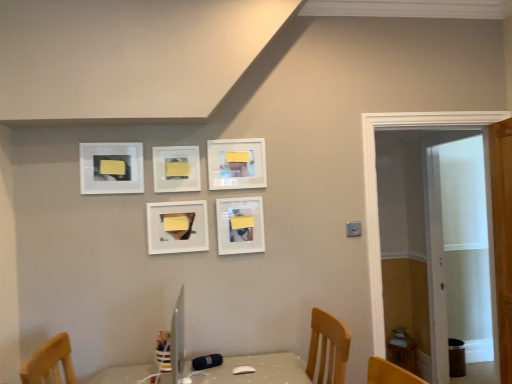
Where is `white wooden door at right`? This screenshot has height=384, width=512. white wooden door at right is located at coordinates (376, 185).

Describe the element at coordinates (236, 163) in the screenshot. I see `matte white picture frame at upper center, which is counted as the second picture frame, starting from the right` at that location.

Based on the photo, measure the distance between point [103,167] and camera.

Point [103,167] and camera are 7.50 feet apart from each other.

Describe the element at coordinates (177, 227) in the screenshot. I see `matte white picture frame at center, marked as the third picture frame in a right-to-left arrangement` at that location.

I want to click on matte white picture frame at center, placed as the 5th picture frame when sorted from left to right, so click(240, 225).

From the image's perspective, is matte white picture frame at center, which appears as the 1th picture frame when viewed from the right, located above yellow matte picture frame at center, the fourth picture frame in the right-to-left sequence?

No, from the image's perspective, matte white picture frame at center, which appears as the 1th picture frame when viewed from the right, is not on top of yellow matte picture frame at center, the fourth picture frame in the right-to-left sequence.

From a real-world perspective, is matte white picture frame at center, which appears as the 1th picture frame when viewed from the right, over yellow matte picture frame at center, the 2th picture frame positioned from the left?

Incorrect, from a real-world perspective, matte white picture frame at center, which appears as the 1th picture frame when viewed from the right, is lower than yellow matte picture frame at center, the 2th picture frame positioned from the left.

Is matte white picture frame at center, which appears as the 1th picture frame when viewed from the right, oriented towards yellow matte picture frame at center, the 2th picture frame positioned from the left?

No, matte white picture frame at center, which appears as the 1th picture frame when viewed from the right, is not turned towards yellow matte picture frame at center, the 2th picture frame positioned from the left.

Is matte white picture frame at center, placed as the 5th picture frame when sorted from left to right, inside or outside of yellow matte picture frame at center, the 2th picture frame positioned from the left?

matte white picture frame at center, placed as the 5th picture frame when sorted from left to right, is outside yellow matte picture frame at center, the 2th picture frame positioned from the left.

In the image, is matte white picture frame at center, which appears as the 1th picture frame when viewed from the right, positioned in front of or behind matte white picture frame at center, marked as the third picture frame in a right-to-left arrangement?

matte white picture frame at center, which appears as the 1th picture frame when viewed from the right, is positioned farther from the viewer than matte white picture frame at center, marked as the third picture frame in a right-to-left arrangement.

From the image's perspective, is matte white picture frame at center, placed as the 5th picture frame when sorted from left to right, on matte white picture frame at center, arranged as the 3th picture frame when viewed from the left?

Yes, from the image's perspective, matte white picture frame at center, placed as the 5th picture frame when sorted from left to right, is above matte white picture frame at center, arranged as the 3th picture frame when viewed from the left.

Between matte white picture frame at center, placed as the 5th picture frame when sorted from left to right, and matte white picture frame at center, marked as the third picture frame in a right-to-left arrangement, which one has more height?

Standing taller between the two is matte white picture frame at center, placed as the 5th picture frame when sorted from left to right.

Consider the image. Are matte white picture frame at center, placed as the 5th picture frame when sorted from left to right, and matte white picture frame at center, marked as the third picture frame in a right-to-left arrangement, beside each other?

There is a gap between matte white picture frame at center, placed as the 5th picture frame when sorted from left to right, and matte white picture frame at center, marked as the third picture frame in a right-to-left arrangement.

From a real-world perspective, is matte white picture frame at center, arranged as the 3th picture frame when viewed from the left, under white wooden door at right?

No.

In the scene shown: From the image's perspective, is matte white picture frame at center, arranged as the 3th picture frame when viewed from the left, below white wooden door at right?

No, from the image's perspective, matte white picture frame at center, arranged as the 3th picture frame when viewed from the left, is not beneath white wooden door at right.

What's the angular difference between matte white picture frame at center, arranged as the 3th picture frame when viewed from the left, and white wooden door at right's facing directions?

They differ by 1.03 degrees in their facing directions.

This screenshot has height=384, width=512. Find the location of `picture frame that is the 2nd object above the white wooden door at right (from a real-world perspective)`. picture frame that is the 2nd object above the white wooden door at right (from a real-world perspective) is located at coordinates (177, 227).

From a real-world perspective, between matte white picture frame at center, placed as the 5th picture frame when sorted from left to right, and matte white picture frame at upper left, the 1th picture frame positioned from the left, who is vertically lower?

From a 3D spatial view, matte white picture frame at center, placed as the 5th picture frame when sorted from left to right, is below.

Is matte white picture frame at center, which appears as the 1th picture frame when viewed from the right, facing away from matte white picture frame at upper left, arranged as the fifth picture frame when viewed from the right?

No.

Can you confirm if matte white picture frame at center, placed as the 5th picture frame when sorted from left to right, is positioned to the right of matte white picture frame at upper left, arranged as the fifth picture frame when viewed from the right?

Yes.

Who is smaller, matte white picture frame at center, placed as the 5th picture frame when sorted from left to right, or matte white picture frame at upper left, the 1th picture frame positioned from the left?

Smaller between the two is matte white picture frame at upper left, the 1th picture frame positioned from the left.

Is white wooden door at right not near yellow matte picture frame at center, the 2th picture frame positioned from the left?

Yes, white wooden door at right and yellow matte picture frame at center, the 2th picture frame positioned from the left, are quite far apart.

Is white wooden door at right situated inside yellow matte picture frame at center, the fourth picture frame in the right-to-left sequence, or outside?

white wooden door at right lies outside yellow matte picture frame at center, the fourth picture frame in the right-to-left sequence.

Is white wooden door at right aimed at yellow matte picture frame at center, the fourth picture frame in the right-to-left sequence?

No, white wooden door at right does not turn towards yellow matte picture frame at center, the fourth picture frame in the right-to-left sequence.

Which picture frame is the 3rd one when counting from the front of the white wooden door at right? Please provide its 2D coordinates.

[(176, 169)]

From the image's perspective, is matte white picture frame at upper left, the 1th picture frame positioned from the left, below yellow matte picture frame at center, the 2th picture frame positioned from the left?

Actually, matte white picture frame at upper left, the 1th picture frame positioned from the left, appears above yellow matte picture frame at center, the 2th picture frame positioned from the left, in the image.

Is matte white picture frame at upper left, arranged as the fifth picture frame when viewed from the right, inside the boundaries of yellow matte picture frame at center, the 2th picture frame positioned from the left, or outside?

matte white picture frame at upper left, arranged as the fifth picture frame when viewed from the right, is not inside yellow matte picture frame at center, the 2th picture frame positioned from the left, it's outside.

Is the position of matte white picture frame at upper left, the 1th picture frame positioned from the left, more distant than that of yellow matte picture frame at center, the fourth picture frame in the right-to-left sequence?

No, the depth of matte white picture frame at upper left, the 1th picture frame positioned from the left, is less than that of yellow matte picture frame at center, the fourth picture frame in the right-to-left sequence.

Locate an element on the screen. the 1st picture frame to the right of the matte white picture frame at upper left, arranged as the fifth picture frame when viewed from the right, counting from the anchor's position is located at coordinates (176, 169).

Is matte white picture frame at upper left, arranged as the fifth picture frame when viewed from the right, behind matte white picture frame at center, which appears as the 1th picture frame when viewed from the right?

No, matte white picture frame at upper left, arranged as the fifth picture frame when viewed from the right, is closer to the camera.

Is matte white picture frame at upper left, the 1th picture frame positioned from the left, beside matte white picture frame at center, which appears as the 1th picture frame when viewed from the right?

They are not placed beside each other.

Does matte white picture frame at upper left, arranged as the fifth picture frame when viewed from the right, have a greater width compared to matte white picture frame at center, placed as the 5th picture frame when sorted from left to right?

No.

Is matte white picture frame at upper left, arranged as the fifth picture frame when viewed from the right, facing away from matte white picture frame at center, placed as the 5th picture frame when sorted from left to right?

matte white picture frame at upper left, arranged as the fifth picture frame when viewed from the right, is not turned away from matte white picture frame at center, placed as the 5th picture frame when sorted from left to right.

From the matte white picture frame at center, placed as the 5th picture frame when sorted from left to right, count the 3rd picture frame to the left and point to it. Please provide its 2D coordinates.

[(176, 169)]

From a real-world perspective, count 1st picture frames upward from the matte white picture frame at center, which appears as the 1th picture frame when viewed from the right, and point to it. Please provide its 2D coordinates.

[(177, 227)]

Looking at the image, which one is located further to yellow matte picture frame at center, the fourth picture frame in the right-to-left sequence, matte white picture frame at center, arranged as the 3th picture frame when viewed from the left, or matte white picture frame at center, which appears as the 1th picture frame when viewed from the right?

matte white picture frame at center, which appears as the 1th picture frame when viewed from the right, lies further to yellow matte picture frame at center, the fourth picture frame in the right-to-left sequence, than the other object.

From the image, which object appears to be nearer to matte white picture frame at upper left, the 1th picture frame positioned from the left, white wooden door at right or matte white picture frame at upper center, which is counted as the second picture frame, starting from the right?

matte white picture frame at upper center, which is counted as the second picture frame, starting from the right, is closer to matte white picture frame at upper left, the 1th picture frame positioned from the left.

From the image, which object appears to be farther from matte white picture frame at center, placed as the 5th picture frame when sorted from left to right, matte white picture frame at center, marked as the third picture frame in a right-to-left arrangement, or matte white picture frame at upper left, arranged as the fifth picture frame when viewed from the right?

matte white picture frame at upper left, arranged as the fifth picture frame when viewed from the right, is further to matte white picture frame at center, placed as the 5th picture frame when sorted from left to right.

Which object lies further to the anchor point matte white picture frame at center, which appears as the 1th picture frame when viewed from the right, yellow matte picture frame at center, the fourth picture frame in the right-to-left sequence, or matte white picture frame at center, marked as the third picture frame in a right-to-left arrangement?

yellow matte picture frame at center, the fourth picture frame in the right-to-left sequence, is positioned further to the anchor matte white picture frame at center, which appears as the 1th picture frame when viewed from the right.

Looking at the image, which one is located further to yellow matte picture frame at center, the 2th picture frame positioned from the left, matte white picture frame at upper center, which is counted as the second picture frame, starting from the right, or white wooden door at right?

The object further to yellow matte picture frame at center, the 2th picture frame positioned from the left, is white wooden door at right.

When comparing their distances from matte white picture frame at center, marked as the third picture frame in a right-to-left arrangement, does matte white picture frame at upper center, acting as the 4th picture frame starting from the left, or matte white picture frame at upper left, the 1th picture frame positioned from the left, seem further?

The object further to matte white picture frame at center, marked as the third picture frame in a right-to-left arrangement, is matte white picture frame at upper left, the 1th picture frame positioned from the left.

Looking at the image, which one is located further to matte white picture frame at center, placed as the 5th picture frame when sorted from left to right, white wooden door at right or yellow matte picture frame at center, the fourth picture frame in the right-to-left sequence?

Based on the image, white wooden door at right appears to be further to matte white picture frame at center, placed as the 5th picture frame when sorted from left to right.

Based on their spatial positions, is matte white picture frame at upper center, acting as the 4th picture frame starting from the left, or matte white picture frame at upper left, the 1th picture frame positioned from the left, further from white wooden door at right?

The object further to white wooden door at right is matte white picture frame at upper left, the 1th picture frame positioned from the left.

Where is `picture frame situated between matte white picture frame at upper center, acting as the 4th picture frame starting from the left, and white wooden door at right from left to right`? Image resolution: width=512 pixels, height=384 pixels. picture frame situated between matte white picture frame at upper center, acting as the 4th picture frame starting from the left, and white wooden door at right from left to right is located at coordinates coord(240,225).

Find the location of `picture frame between matte white picture frame at upper left, arranged as the fifth picture frame when viewed from the right, and matte white picture frame at center, arranged as the 3th picture frame when viewed from the left, from left to right`. picture frame between matte white picture frame at upper left, arranged as the fifth picture frame when viewed from the right, and matte white picture frame at center, arranged as the 3th picture frame when viewed from the left, from left to right is located at coordinates (176, 169).